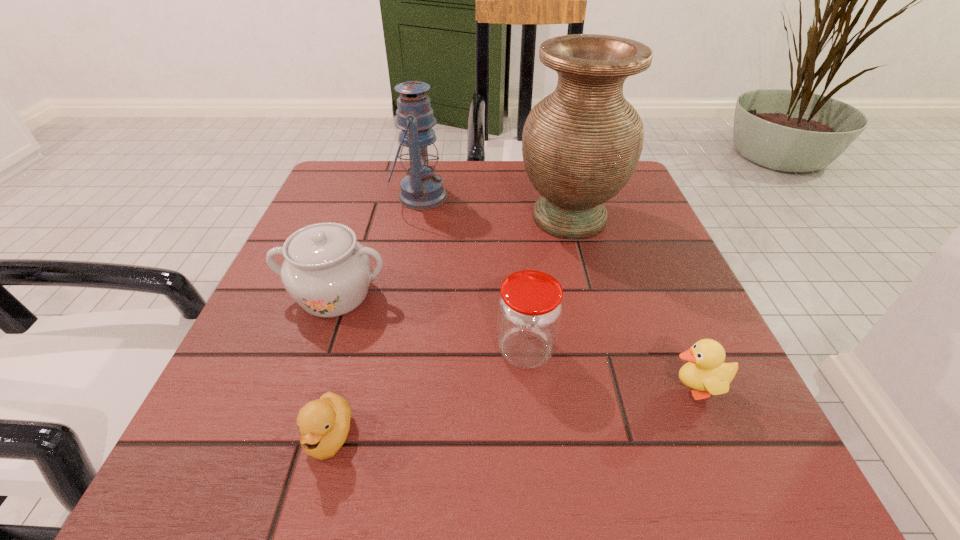
Locate an element on the screen. The height and width of the screenshot is (540, 960). free point located on the front of the fourth nearest object is located at coordinates (299, 399).

Image resolution: width=960 pixels, height=540 pixels. I want to click on free location located on the back of the jar, so click(518, 276).

Image resolution: width=960 pixels, height=540 pixels. Identify the location of vacant position located 0.150m on the front-facing side of the fifth tallest object. (563, 388).

Locate an element on the screen. free region located 0.170m on the front-facing side of the fifth tallest object is located at coordinates (549, 388).

In order to click on free region located 0.080m on the front-facing side of the fifth tallest object in this screenshot , I will do `click(611, 388)`.

Identify the location of vase positioned at the far edge. Image resolution: width=960 pixels, height=540 pixels. (581, 144).

Where is `lantern located at the far edge`? The height and width of the screenshot is (540, 960). lantern located at the far edge is located at coordinates click(421, 189).

Where is `object positioned at the near edge`? The height and width of the screenshot is (540, 960). object positioned at the near edge is located at coordinates (324, 423).

Locate an element on the screen. chinaware located at the left edge is located at coordinates click(327, 272).

Find the location of a particular element. Image resolution: width=960 pixels, height=540 pixels. duckling at the left edge is located at coordinates (324, 423).